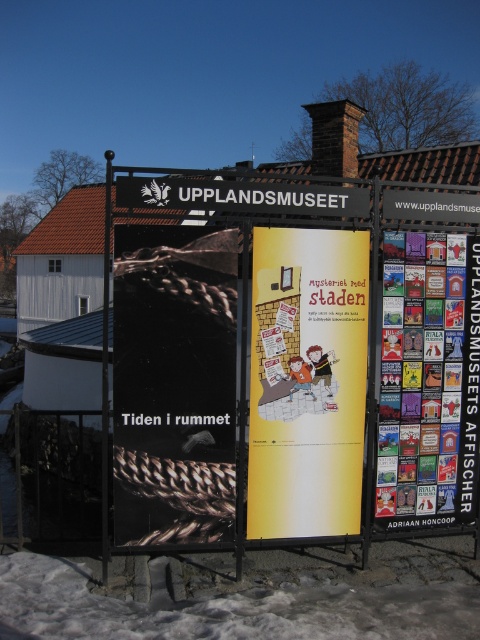
You are a visitor at the museum and want to take a photo of the black matte poster at center and the white powdery snow at lower left. Which object should you focus on first if you want to capture both in one frame without moving the camera?

The black matte poster at center has a greater height compared to the white powdery snow at lower left. Since the poster is taller, you should focus on the black matte poster at center first to ensure it fits within the frame, then adjust the camera angle slightly downward to include the white powdery snow at lower left without moving the camera.

What is located at the point with coordinates (307, 381) on the museum display board?

The point with coordinates (307, 381) on the museum display board corresponds to the yellow paper poster at center.

You are standing in front of the museum display board and want to take a photo of the multicolored paper posters at right. Your camera is 14.97 feet away from them. Is the camera close enough to capture the posters clearly?

The multicolored paper posters at right and camera are 14.97 feet apart from each other, so the camera is at the correct distance to capture the posters clearly since they are exactly 14.97 feet away.